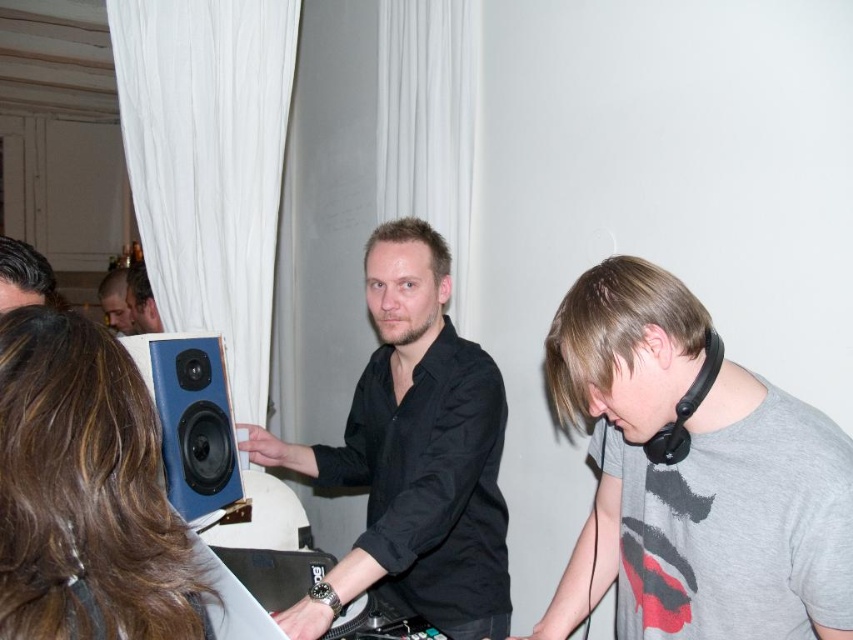
Is black matte shirt at center taller than blue matte speaker at left?

Indeed, black matte shirt at center has a greater height compared to blue matte speaker at left.

Can you confirm if black matte shirt at center is positioned to the left of blue matte speaker at left?

No, black matte shirt at center is not to the left of blue matte speaker at left.

What are the coordinates of `black matte shirt at center` in the screenshot? It's located at (413, 456).

Is blue matte speaker at left shorter than matte black speaker at center?

Incorrect, blue matte speaker at left's height does not fall short of matte black speaker at center's.

Is point (155, 365) farther from viewer compared to point (120, 276)?

No, it is not.

The width and height of the screenshot is (853, 640). I want to click on blue matte speaker at left, so click(194, 422).

Does blue matte speaker at left have a larger size compared to matte black headphones at upper left?

No, blue matte speaker at left is not bigger than matte black headphones at upper left.

Which of these two, blue matte speaker at left or matte black headphones at upper left, stands shorter?

Standing shorter between the two is matte black headphones at upper left.

Where is `blue matte speaker at left`? blue matte speaker at left is located at coordinates coord(194,422).